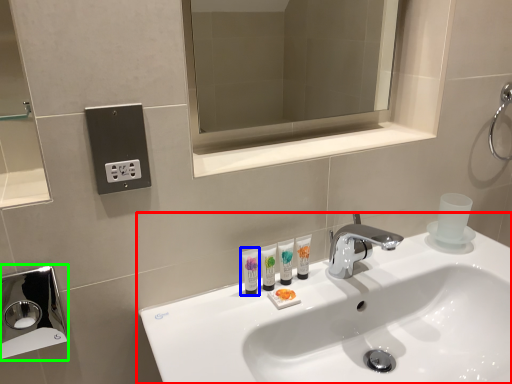
Question: Which object is positioned farthest from sink (highlighted by a red box)? Select from mouthwash (highlighted by a blue box) and hand dryer (highlighted by a green box).

Choices:
 (A) mouthwash
 (B) hand dryer

Answer: (B)